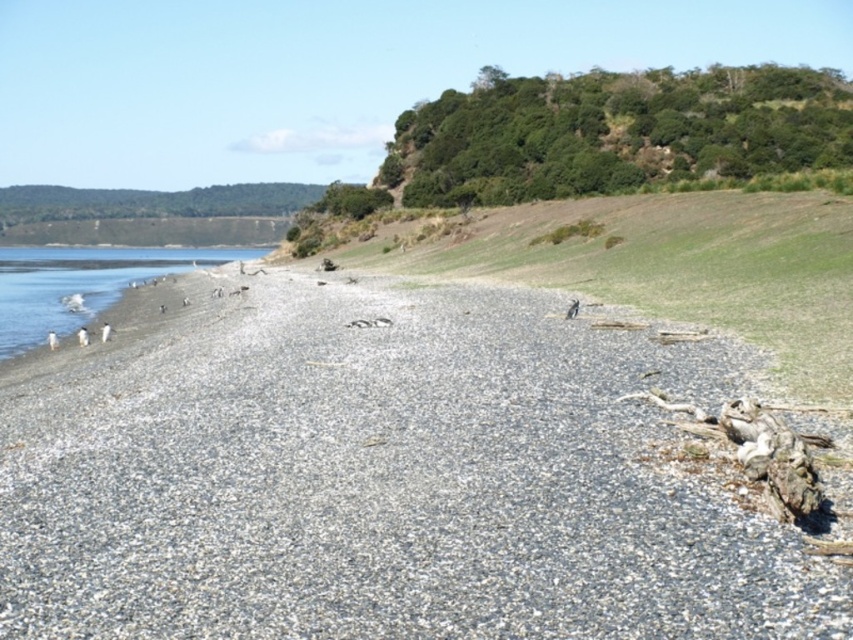
In the scene shown: You are standing on the pebble beach and see two points marked on the ground, one at point (213, 326) and the other at point (175, 273). Which point is closer to you?

Point (213, 326) is in front of point (175, 273), so it is closer to you.

You are standing on the beach and want to walk towards the water. Which type of sand will you step on first? The gray gravelly sand at lower left or the white sand at lower left?

The gray gravelly sand at lower left is in front of the white sand at lower left, so you will step on the gray gravelly sand at lower left first.